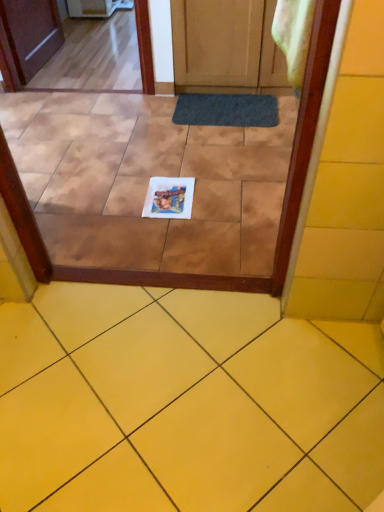
You are a GUI agent. You are given a task and a screenshot of the screen. Output one action in this format:
    pyautogui.click(x=<x>, y=<y>)
    Task: Click on the free space above white glossy coaster at center (from a real-world perspective)
    This screenshot has width=384, height=512.
    Given the screenshot: What is the action you would take?
    pyautogui.click(x=170, y=194)